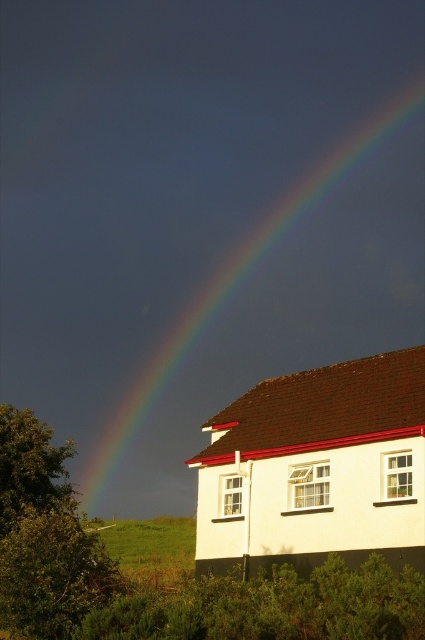
Is rainbow at upper right positioned in front of white painted wall at center?

No, it is behind white painted wall at center.

Can you confirm if rainbow at upper right is positioned below white painted wall at center?

No.

This screenshot has width=425, height=640. I want to click on rainbow at upper right, so click(266, 307).